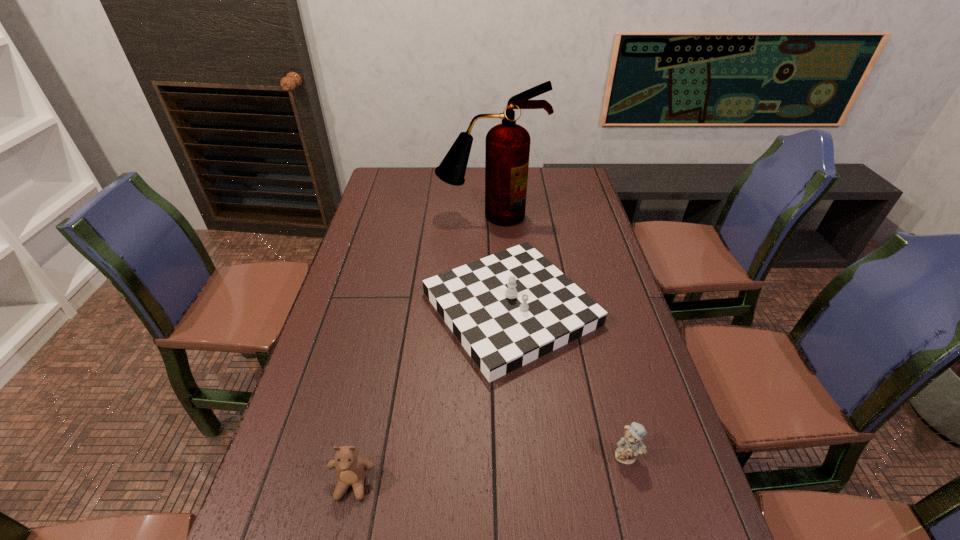
You are a GUI agent. You are given a task and a screenshot of the screen. Output one action in this format:
    pyautogui.click(x=<x>, y=<y>)
    Task: Click on the checkerboard that is at the right edge
    This screenshot has height=540, width=960.
    Given the screenshot: What is the action you would take?
    click(x=508, y=309)

You are a GUI agent. You are given a task and a screenshot of the screen. Output one action in this format:
    pyautogui.click(x=<x>, y=<y>)
    Task: Click on the teddy bear situated at the right edge
    This screenshot has width=960, height=540.
    Given the screenshot: What is the action you would take?
    pyautogui.click(x=629, y=446)

I want to click on vacant space at the far edge, so click(x=416, y=183).

Identify the location of free space at the left edge. (364, 392).

Identify the location of free space at the right edge of the desktop. (630, 465).

This screenshot has width=960, height=540. I want to click on free space between the left teddy bear and the checkerboard, so click(432, 396).

The height and width of the screenshot is (540, 960). Find the location of `free space that is in between the checkerboard and the right teddy bear`. free space that is in between the checkerboard and the right teddy bear is located at coordinates (568, 382).

I want to click on vacant space in between the left teddy bear and the right teddy bear, so click(490, 470).

I want to click on vacant region between the left teddy bear and the tallest object, so click(421, 350).

At what (x,y) coordinates should I click in order to perform the action: click on vacant point located between the right teddy bear and the left teddy bear. Please return your answer as a coordinate pair (x, y). Image resolution: width=960 pixels, height=540 pixels. Looking at the image, I should click on (490, 470).